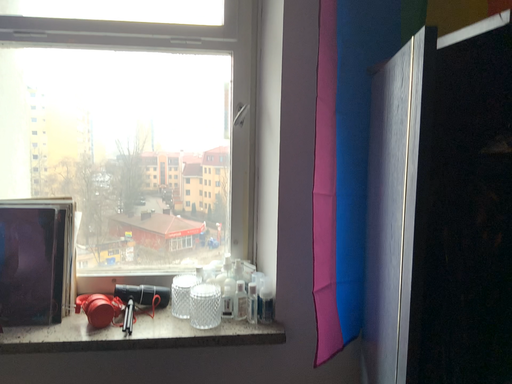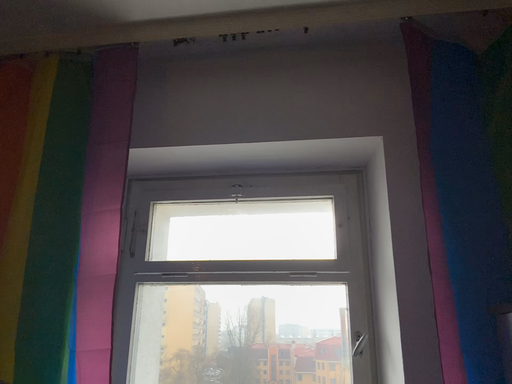
Question: How did the camera likely rotate when shooting the video?

Choices:
 (A) rotated upward
 (B) rotated downward

Answer: (A)